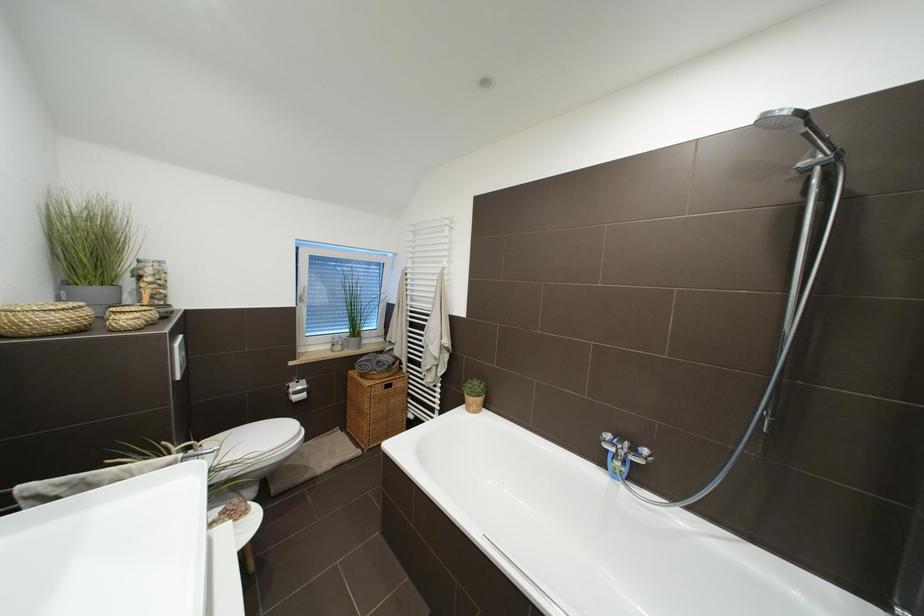
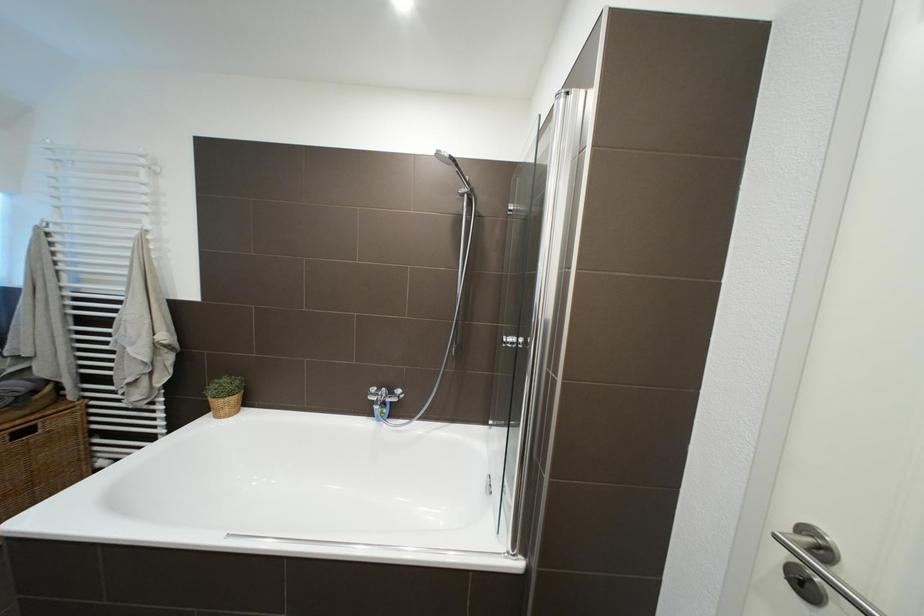
Question: The images are taken continuously from a first-person perspective. In which direction is your viewpoint rotating?

Choices:
 (A) Left
 (B) Right
 (C) Up
 (D) Down

Answer: (B)